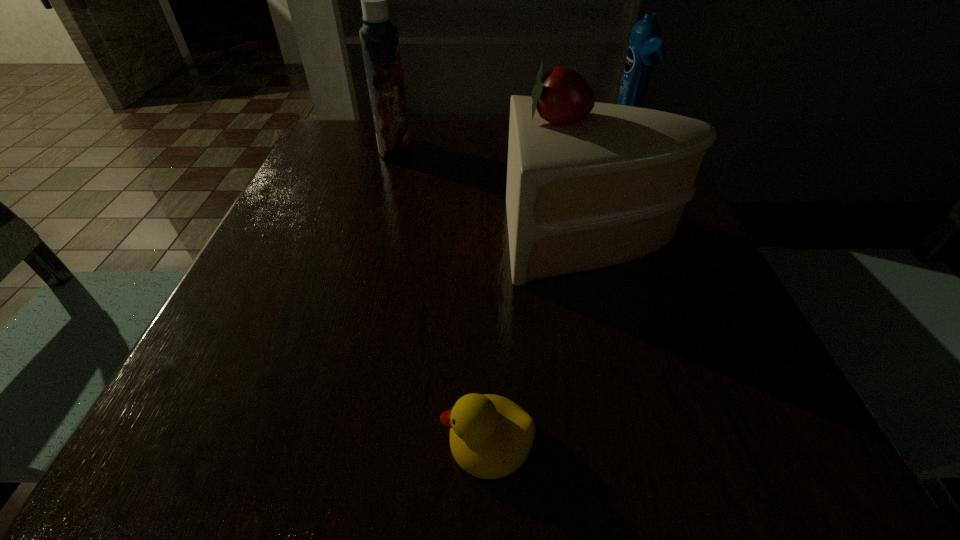
Where is `vacant region between the rightmost gold watch and the yellow sunflower`? vacant region between the rightmost gold watch and the yellow sunflower is located at coordinates (448, 245).

You are a GUI agent. You are given a task and a screenshot of the screen. Output one action in this format:
    pyautogui.click(x=<x>, y=<y>)
    Task: Click on the empty space that is in between the smallest gold watch and the biggest gray watch
    
    Given the screenshot: What is the action you would take?
    pyautogui.click(x=385, y=322)

This screenshot has width=960, height=540. What are the coordinates of `free space between the smallest gold watch and the farthest gray watch` in the screenshot? It's located at (385, 322).

Identify the location of unoccupied position between the second nearest gray watch and the second smallest gold watch. The image size is (960, 540). (602, 320).

Where is `empty location between the biggest gold watch and the eighth nearest object`? This screenshot has height=540, width=960. empty location between the biggest gold watch and the eighth nearest object is located at coordinates (478, 188).

The image size is (960, 540). Identify the location of blank region between the leftmost gray watch and the hourglass. (571, 201).

Where is `unoccupied area between the second farthest gray watch and the yellow sunflower`? The image size is (960, 540). unoccupied area between the second farthest gray watch and the yellow sunflower is located at coordinates (527, 208).

Find the location of a particular element. object that is the third closest to the candle holder is located at coordinates (511, 230).

Select which object appears as the closest to the candle holder. Please provide its 2D coordinates. Your answer should be formatted as a tuple, i.e. [(x, y)], where the tuple contains the x and y coordinates of a point satisfying the conditions above.

[(273, 383)]

Identify which watch is the second nearest to the rightmost gold watch. Please provide its 2D coordinates. Your answer should be formatted as a tuple, i.e. [(x, y)], where the tuple contains the x and y coordinates of a point satisfying the conditions above.

[(511, 230)]